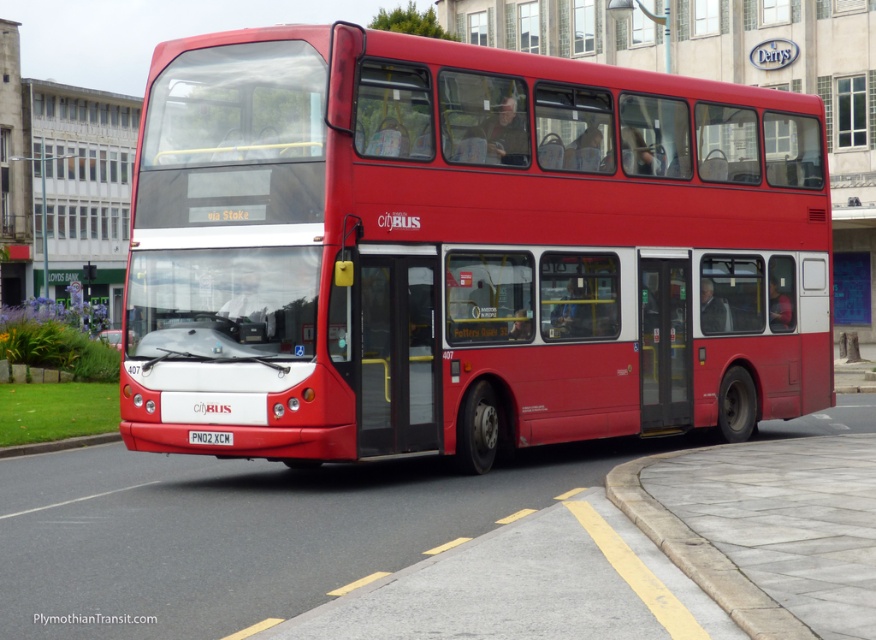
Question: Does matte red bus at center have a lesser width compared to red plastic license plate at center?

Choices:
 (A) no
 (B) yes

Answer: (A)

Question: Where is matte red bus at center located in relation to red plastic license plate at center in the image?

Choices:
 (A) left
 (B) right

Answer: (B)

Question: Is matte red bus at center above red plastic license plate at center?

Choices:
 (A) yes
 (B) no

Answer: (A)

Question: Which point appears farthest from the camera in this image?

Choices:
 (A) [x=168, y=342]
 (B) [x=189, y=438]

Answer: (A)

Question: Which of the following is the closest to the observer?

Choices:
 (A) red plastic license plate at center
 (B) matte red bus at center

Answer: (B)